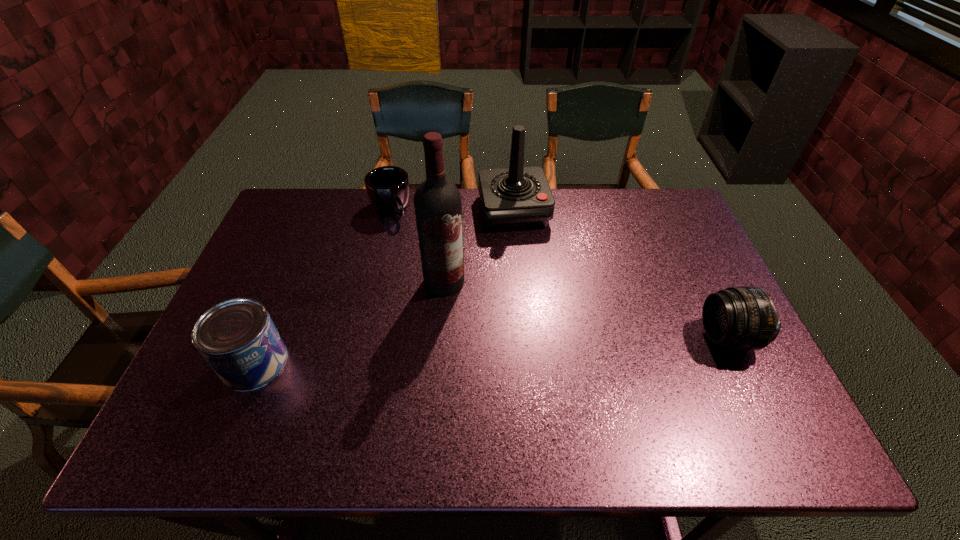
This screenshot has height=540, width=960. Identify the location of free point between the rightmost object and the third object from right to left. (586, 309).

Identify the location of free space that is in between the leftmost object and the joystick. The height and width of the screenshot is (540, 960). (384, 287).

This screenshot has width=960, height=540. I want to click on unoccupied position between the can and the mug, so click(x=323, y=286).

Locate an element on the screen. vacant area between the leftmost object and the wine bottle is located at coordinates (349, 322).

This screenshot has height=540, width=960. Find the location of `free spot between the rightmost object and the can`. free spot between the rightmost object and the can is located at coordinates (491, 350).

Find the location of a particular element. This screenshot has width=960, height=540. empty space that is in between the third farthest object and the rightmost object is located at coordinates (586, 309).

Image resolution: width=960 pixels, height=540 pixels. In order to click on free space between the shortest object and the third object from right to left in this screenshot , I will do `click(418, 245)`.

Find the location of `blank region between the leftmost object and the rightmost object`. blank region between the leftmost object and the rightmost object is located at coordinates (491, 350).

Select which object appears as the fourth closest to the tallest object. Please provide its 2D coordinates. Your answer should be formatted as a tuple, i.e. [(x, y)], where the tuple contains the x and y coordinates of a point satisfying the conditions above.

[(744, 317)]

Where is `the second closest object to the fourth object from left to right`? Image resolution: width=960 pixels, height=540 pixels. the second closest object to the fourth object from left to right is located at coordinates (388, 188).